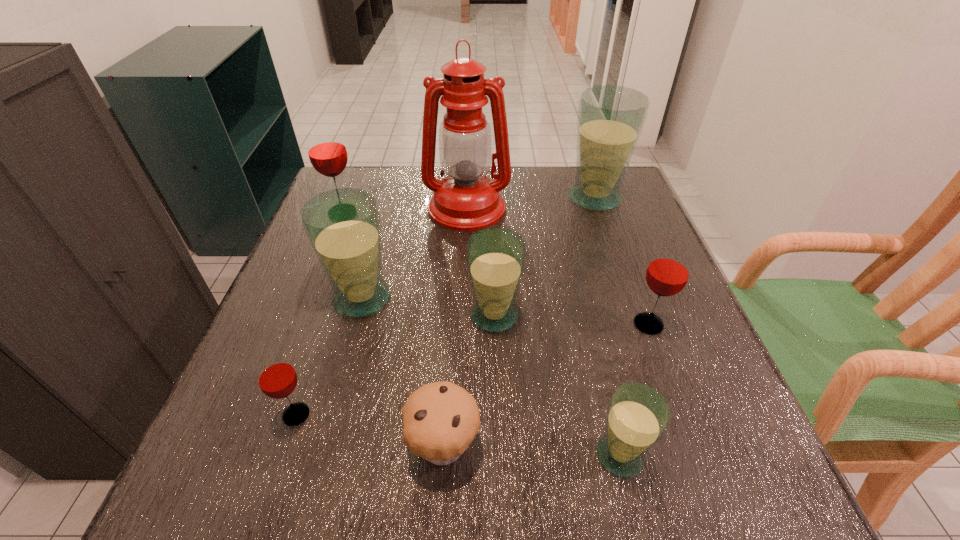
This screenshot has width=960, height=540. Find the location of `vacant region at the left edge`. vacant region at the left edge is located at coordinates (301, 443).

In the image, there is a desktop. At what (x,y) coordinates should I click in order to perform the action: click on vacant space at the right edge. Please return your answer as a coordinate pair (x, y). Image resolution: width=960 pixels, height=540 pixels. Looking at the image, I should click on (664, 389).

The width and height of the screenshot is (960, 540). I want to click on vacant space at the far left corner of the desktop, so point(330,181).

Image resolution: width=960 pixels, height=540 pixels. In the image, there is a desktop. In order to click on vacant space at the near left corner in this screenshot , I will do `click(252, 455)`.

This screenshot has height=540, width=960. In order to click on vacant area at the far right corner in this screenshot , I will do `click(573, 175)`.

The height and width of the screenshot is (540, 960). In the image, there is a desktop. What are the coordinates of `vacant region at the near right corner` in the screenshot? It's located at (696, 484).

Where is `free area in between the third blue glass from right to left and the farthest red glass`? The image size is (960, 540). free area in between the third blue glass from right to left and the farthest red glass is located at coordinates (419, 265).

Identify the location of free space between the farthest red glass and the muffin. (393, 329).

This screenshot has width=960, height=540. I want to click on free spot between the sixth farthest glass and the second biggest blue glass, so click(x=329, y=356).

What are the coordinates of `vacant area that lies between the muffin and the second nearest red glass` in the screenshot? It's located at (546, 384).